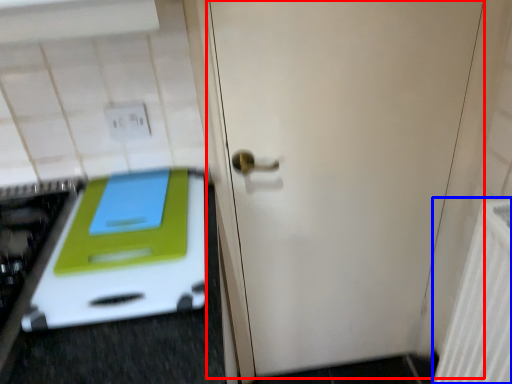
Question: Which point is closer to the camera, door (highlighted by a red box) or radiator (highlighted by a blue box)?

Choices:
 (A) door
 (B) radiator

Answer: (B)